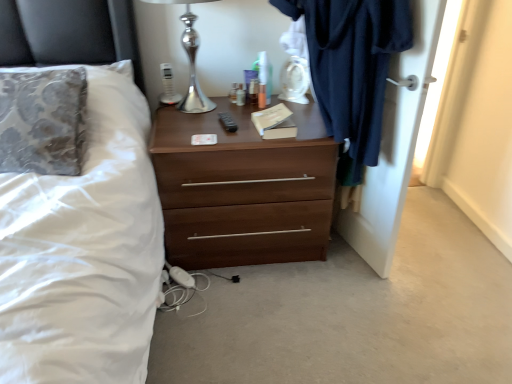
Locate an element on the screen. The width and height of the screenshot is (512, 384). unoccupied area in front of dark blue fabric at right is located at coordinates (374, 309).